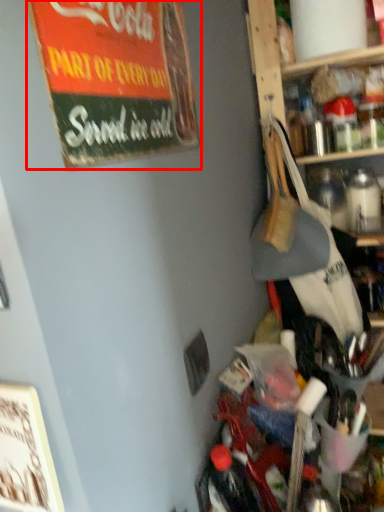
Question: From the image, what is the correct spatial relationship of bulletin board (annotated by the red box) in relation to bottle?

Choices:
 (A) right
 (B) left

Answer: (B)